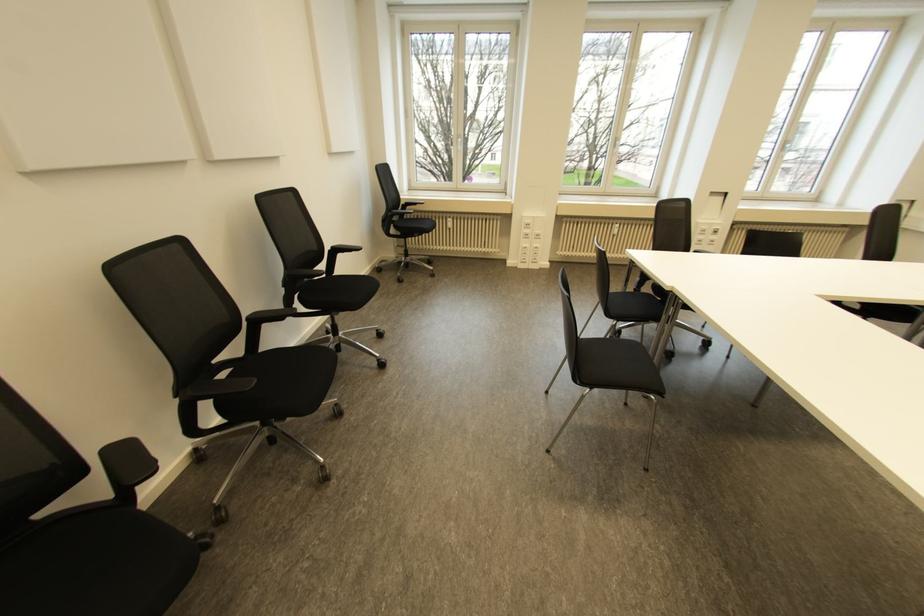
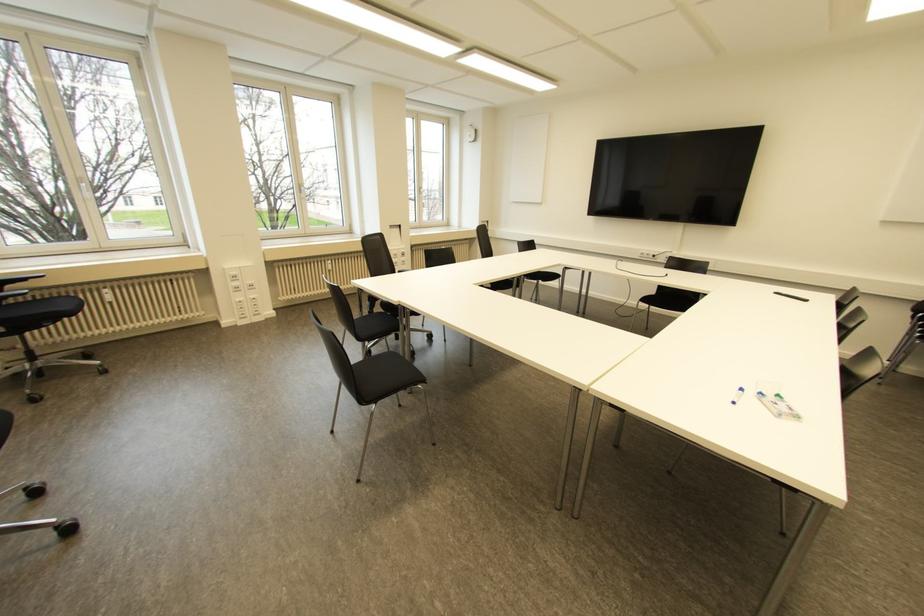
Locate, in the second image, the point that corresponds to point (660, 392) in the first image.

(422, 381)